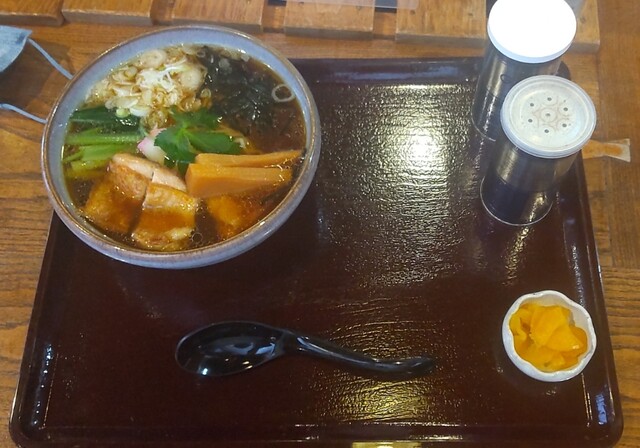
Locate an element on the screen. This screenshot has width=640, height=448. separated wooden boards is located at coordinates click(584, 30), click(427, 29), click(329, 21), click(227, 20), click(116, 10), click(33, 16).